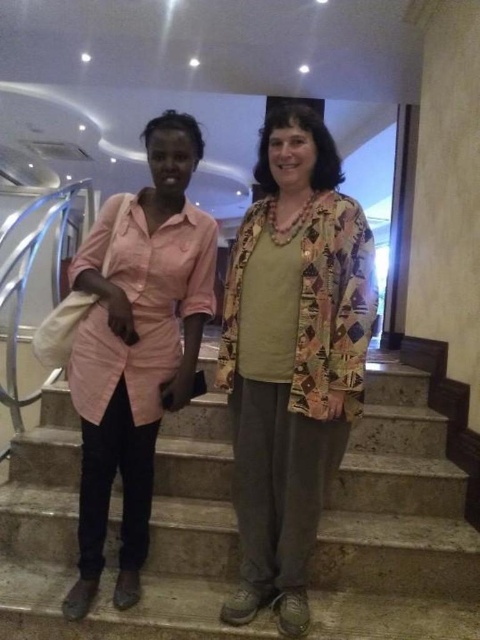
You are standing at the bottom of the staircase and want to reach the top. The gray concrete stairs at center are marked by point (x=118, y=531). How many steps are there between you and the top?

The gray concrete stairs at center is represented by point (x=118, y=531). However, the number of steps between you and the top cannot be determined from the provided information.

You are a delivery robot with a box that is 25 inches wide. You need to move past the pink fabric shirt at center to reach the delivery location on the gray concrete stairs at center. Can your box fit through the space between them?

The distance between the gray concrete stairs at center and the pink fabric shirt at center is 24.86 inches. Since the box is 25 inches wide, it cannot fit through the space between them.

Consider the image. Based on the coordinates provided, which object corresponds to the point with the coordinates (x=291, y=356)?

The pink cotton shirt at left corresponds to the point with the coordinates (x=291, y=356).